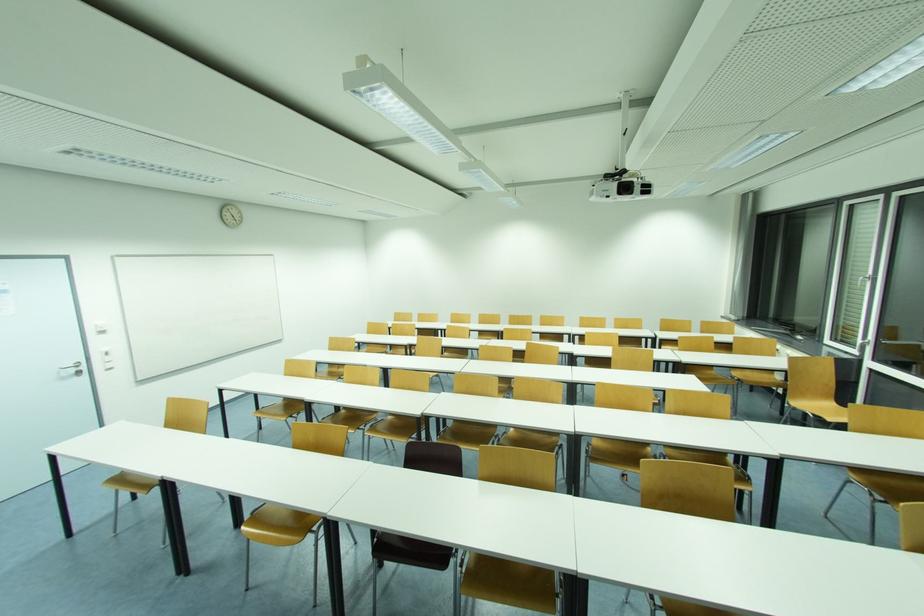
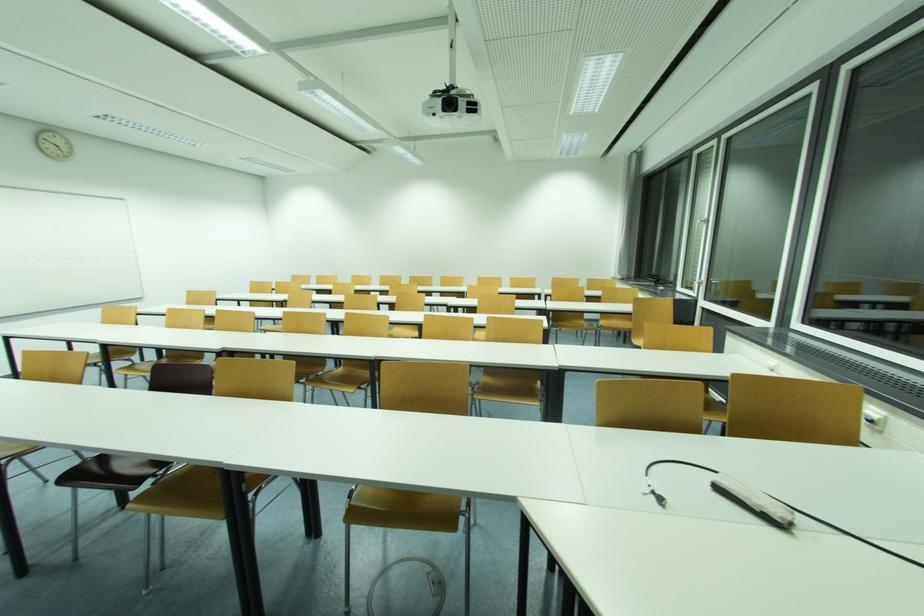
Question: What movement of the cameraman would produce the second image?

Choices:
 (A) Left
 (B) Right
 (C) Forward
 (D) Backward

Answer: (B)